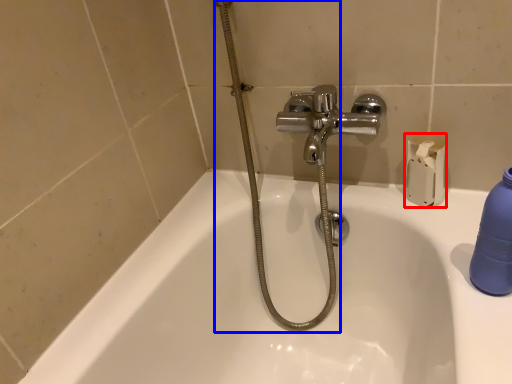
Question: Which of the following is the closest to the observer, toilet paper (highlighted by a red box) or shower (highlighted by a blue box)?

Choices:
 (A) toilet paper
 (B) shower

Answer: (B)